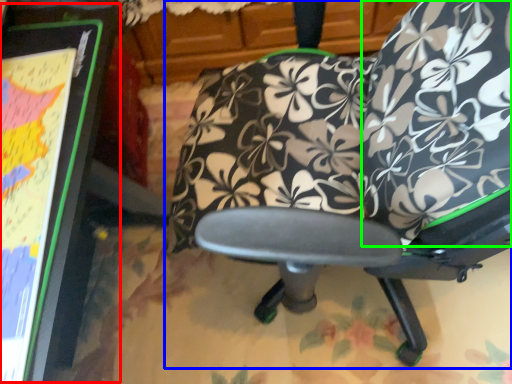
Question: Considering the real-world distances, which object is farthest from bulletin board (highlighted by a red box)? chair (highlighted by a blue box) or bean bag chair (highlighted by a green box)?

Choices:
 (A) chair
 (B) bean bag chair

Answer: (B)